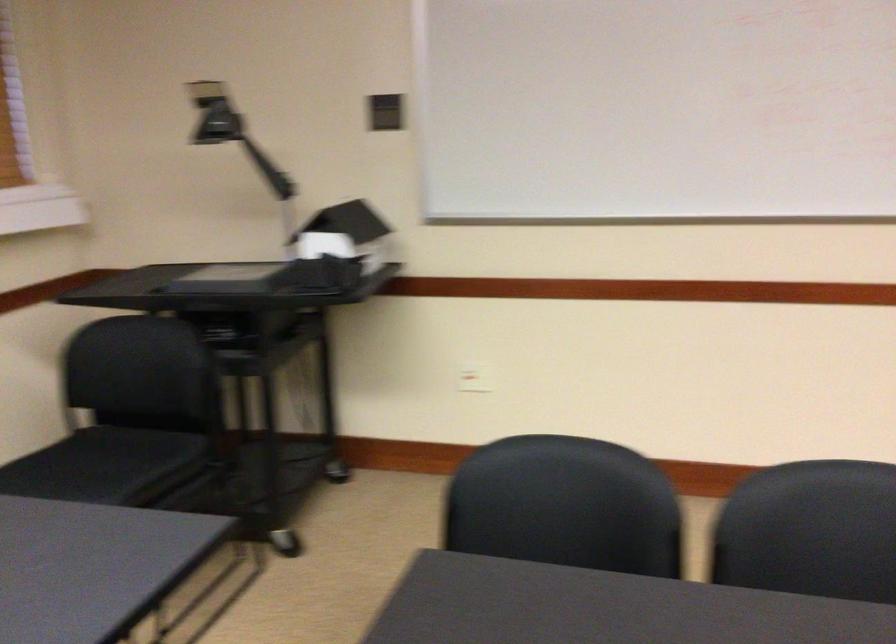
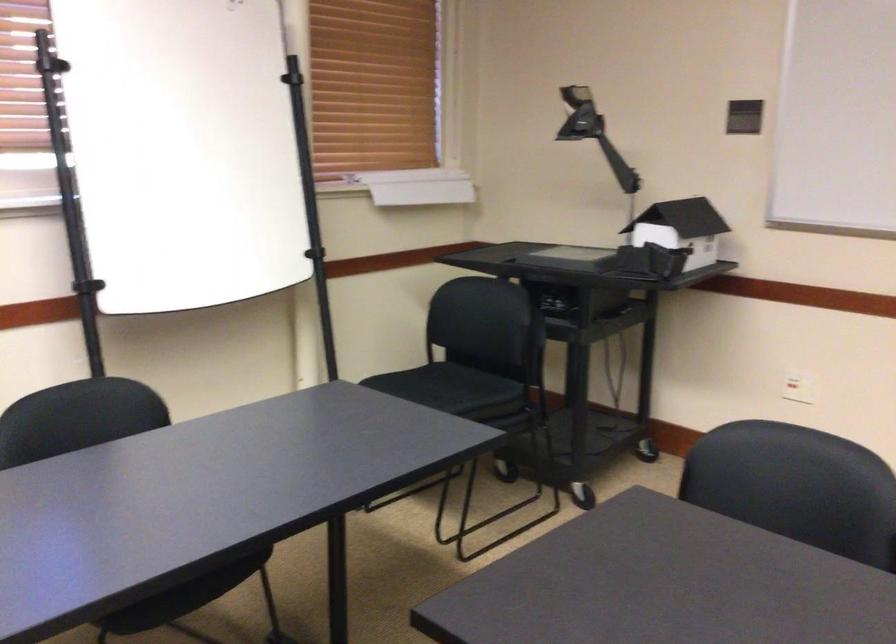
Find the pixel in the second image that matches (x=323, y=297) in the first image.

(635, 279)